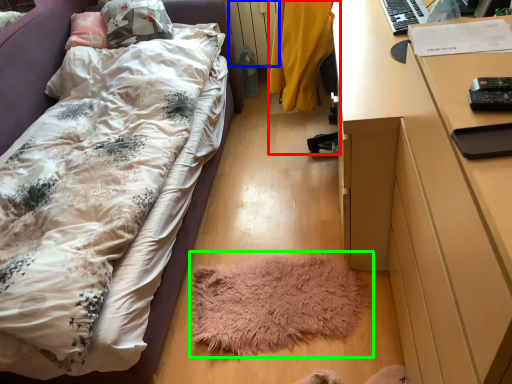
Question: Considering the real-world distances, which object is closest to chair (highlighted by a red box)? radiator (highlighted by a blue box) or mat (highlighted by a green box).

Choices:
 (A) radiator
 (B) mat

Answer: (B)